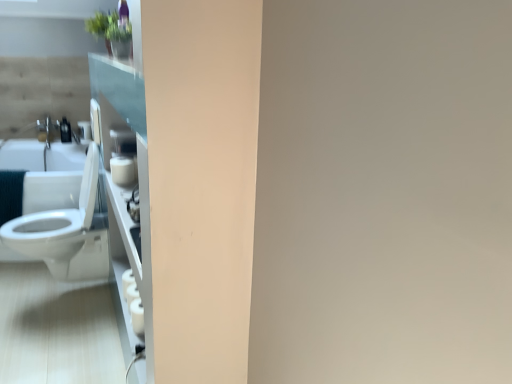
Question: From the image's perspective, relative to white glossy sink at left, is white glossy toilet at left above or below?

Choices:
 (A) below
 (B) above

Answer: (A)

Question: Looking at the image, does white glossy toilet at left seem bigger or smaller compared to white glossy sink at left?

Choices:
 (A) big
 (B) small

Answer: (A)

Question: Which is farther from the white glossy sink at left?

Choices:
 (A) matte white soap dispenser at left
 (B) white glossy toilet at left
 (C) white matte toilet paper at lower left

Answer: (C)

Question: Considering the real-world distances, which object is farthest from the white glossy toilet at left?

Choices:
 (A) white glossy sink at left
 (B) matte white soap dispenser at left
 (C) white matte toilet paper at lower left

Answer: (B)